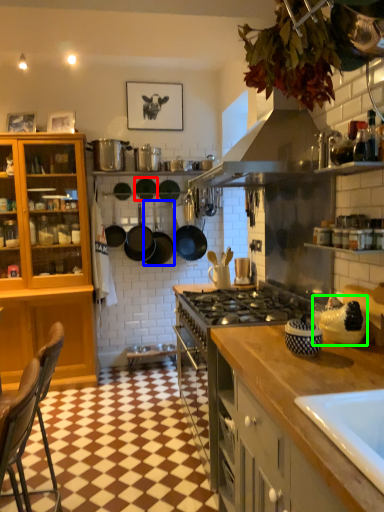
Question: Which object is the farthest from frying pan (highlighted by a red box)? Choose among these: kitchen appliance (highlighted by a blue box) or appliance (highlighted by a green box).

Choices:
 (A) kitchen appliance
 (B) appliance

Answer: (B)